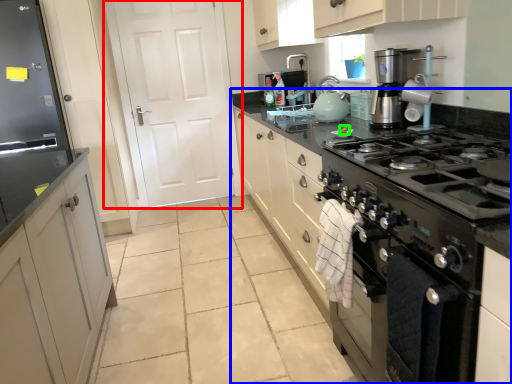
Question: Estimate the real-world distances between objects in this image. Which object is closer to door (highlighted by a red box), countertop (highlighted by a blue box) or food (highlighted by a green box)?

Choices:
 (A) countertop
 (B) food

Answer: (B)